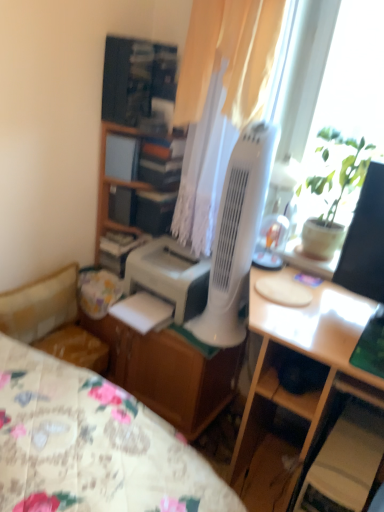
Question: Is white matte printer at center aimed at light wood desk at center?

Choices:
 (A) no
 (B) yes

Answer: (A)

Question: Is white matte printer at center next to light wood desk at center?

Choices:
 (A) yes
 (B) no

Answer: (B)

Question: From the image's perspective, would you say white matte printer at center is positioned over light wood desk at center?

Choices:
 (A) no
 (B) yes

Answer: (B)

Question: Is white matte printer at center thinner than light wood desk at center?

Choices:
 (A) no
 (B) yes

Answer: (B)

Question: Does white matte printer at center have a greater width compared to light wood desk at center?

Choices:
 (A) no
 (B) yes

Answer: (A)

Question: Is wooden bookshelf at upper center taller or shorter than floral fabric studio couch at lower left?

Choices:
 (A) tall
 (B) short

Answer: (B)

Question: In the image, is wooden bookshelf at upper center on the left side or the right side of floral fabric studio couch at lower left?

Choices:
 (A) left
 (B) right

Answer: (B)

Question: From a real-world perspective, is wooden bookshelf at upper center physically located above or below floral fabric studio couch at lower left?

Choices:
 (A) above
 (B) below

Answer: (A)

Question: Considering the positions of wooden bookshelf at upper center and floral fabric studio couch at lower left in the image, is wooden bookshelf at upper center bigger or smaller than floral fabric studio couch at lower left?

Choices:
 (A) big
 (B) small

Answer: (B)

Question: From a real-world perspective, is light wood desk at center above or below wooden cabinet at center-left?

Choices:
 (A) above
 (B) below

Answer: (B)

Question: From the image's perspective, is light wood desk at center above or below wooden cabinet at center-left?

Choices:
 (A) below
 (B) above

Answer: (A)

Question: In terms of height, does light wood desk at center look taller or shorter compared to wooden cabinet at center-left?

Choices:
 (A) short
 (B) tall

Answer: (B)

Question: Looking at the image, does light wood desk at center seem bigger or smaller compared to wooden cabinet at center-left?

Choices:
 (A) small
 (B) big

Answer: (B)

Question: From the image's perspective, is green leafy plant at upper right positioned above or below wooden cabinet at center-left?

Choices:
 (A) below
 (B) above

Answer: (A)

Question: In terms of width, does green leafy plant at upper right look wider or thinner when compared to wooden cabinet at center-left?

Choices:
 (A) thin
 (B) wide

Answer: (A)